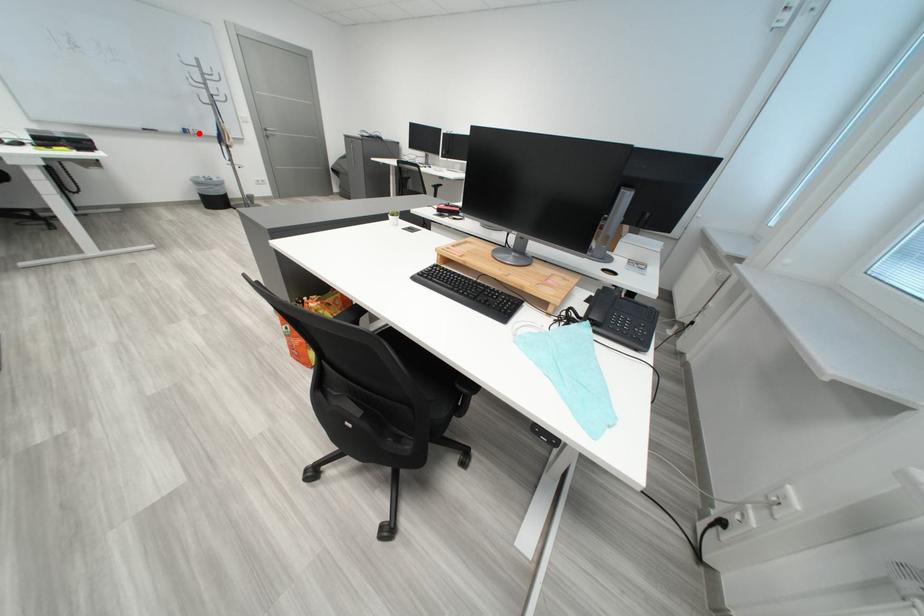
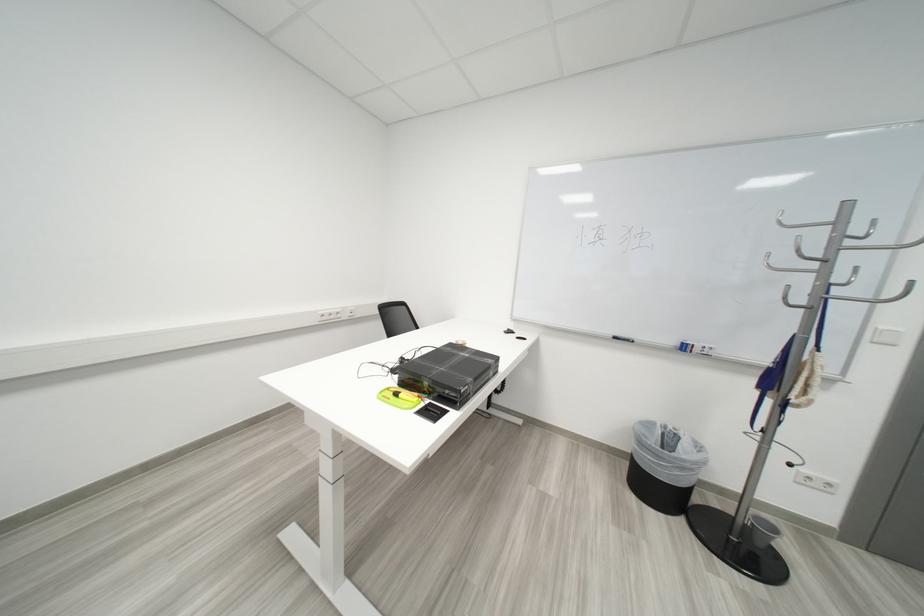
Locate, in the second image, the point that corresponds to the highlighted location in the first image.

(698, 350)